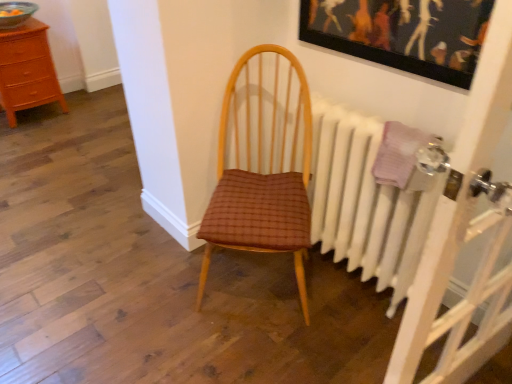
I want to click on vacant space to the left of white painted radiator at right, so click(x=257, y=310).